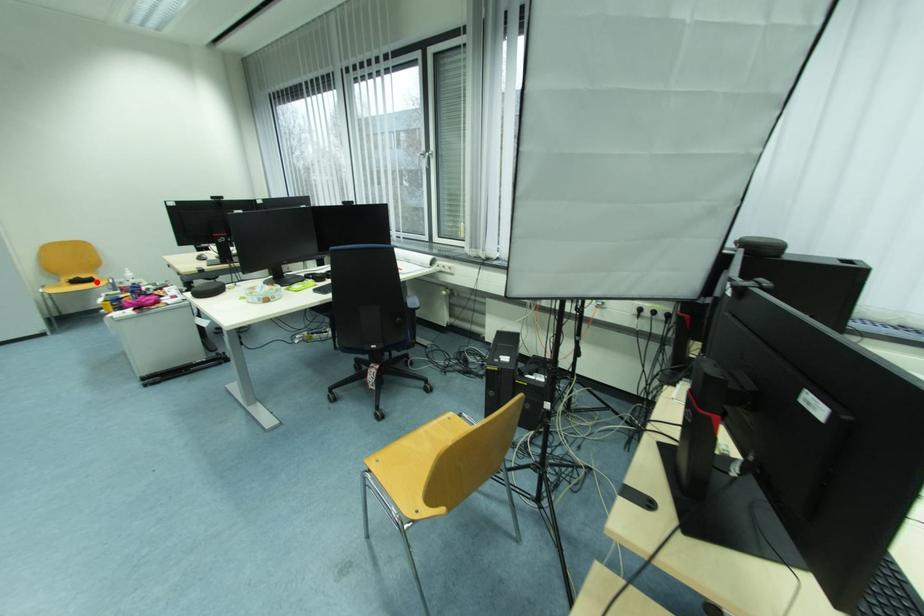
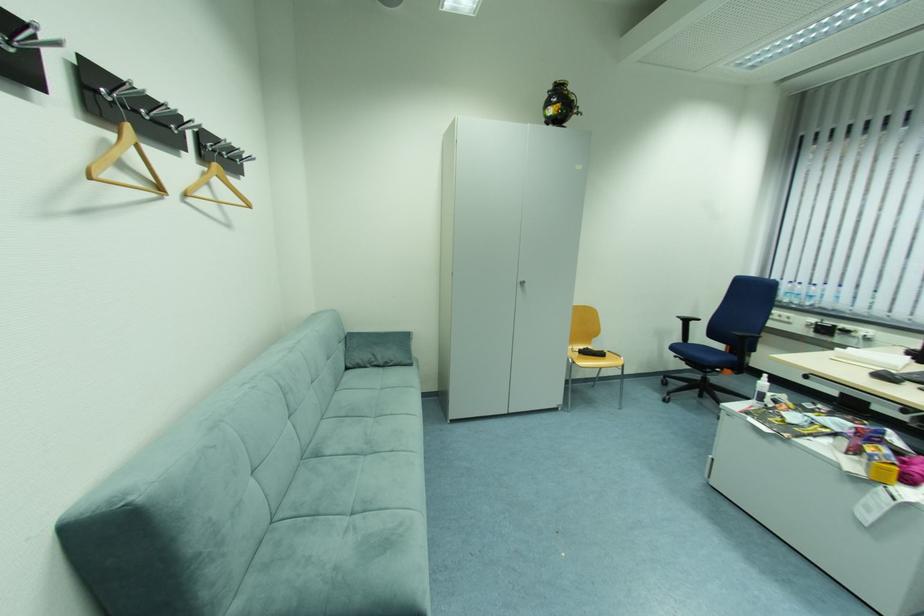
Question: I am providing you with two images of the same scene from different viewpoints. In image1, a red point is highlighted. Considering the same 3D point in image2, which of the following is correct?

Choices:
 (A) It is closer
 (B) It is farther

Answer: (A)